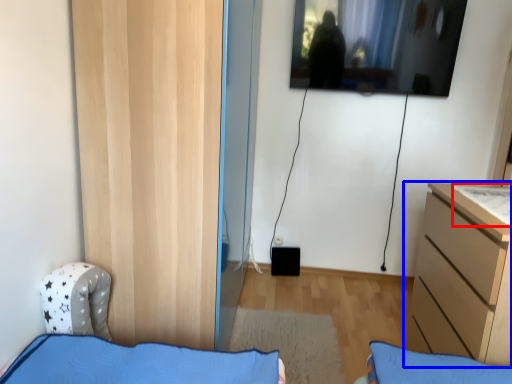
Question: Among these objects, which one is farthest to the camera, sheet (highlighted by a red box) or chest of drawers (highlighted by a blue box)?

Choices:
 (A) sheet
 (B) chest of drawers

Answer: (A)